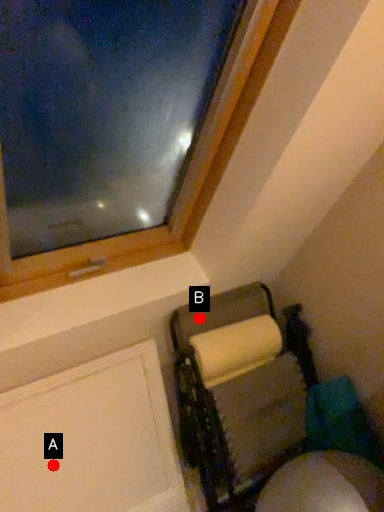
Question: Two points are circled on the image, labeled by A and B beside each circle. Which point appears farthest from the camera in this image?

Choices:
 (A) A is further
 (B) B is further

Answer: (B)